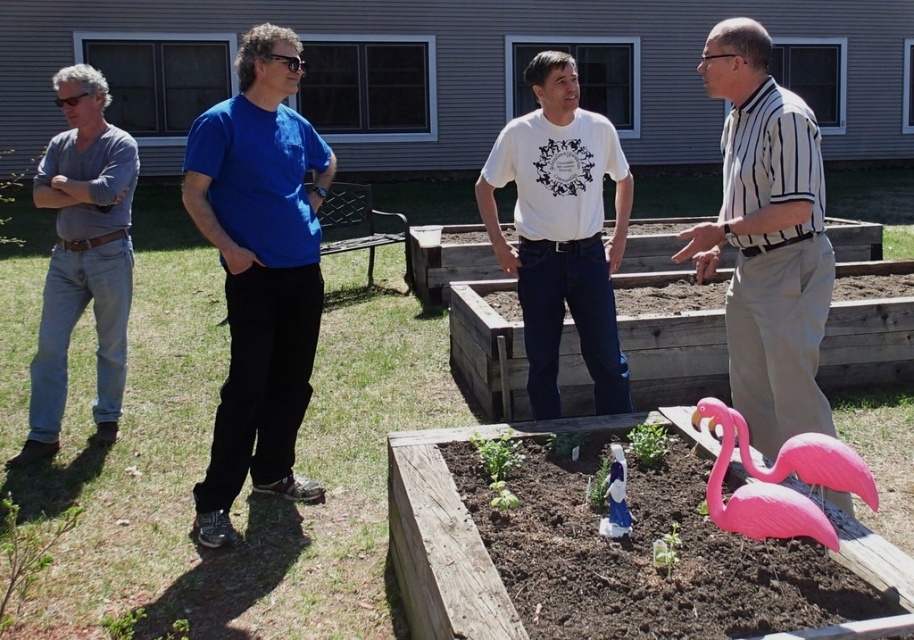
You are a photographer trying to capture a group photo of the four people in the garden. The camera you are using has a minimum focusing distance of 3 meters. Can you take a clear photo of the striped cotton shirt at right without moving the camera?

The striped cotton shirt at right and the camera are 2.90 meters apart, which is less than the minimum focusing distance of 3 meters. Therefore, you cannot take a clear photo of the striped cotton shirt at right without moving the camera closer.